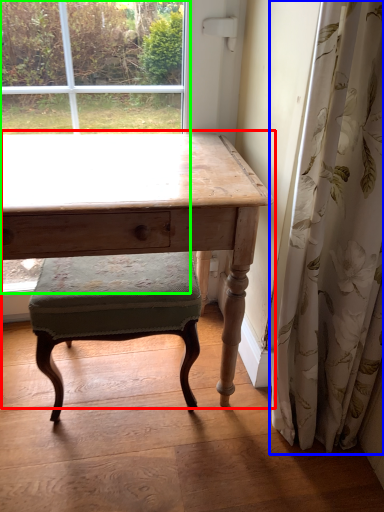
Question: Which is farther away from table (highlighted by a red box)? curtain (highlighted by a blue box) or bay window (highlighted by a green box)?

Choices:
 (A) curtain
 (B) bay window

Answer: (B)